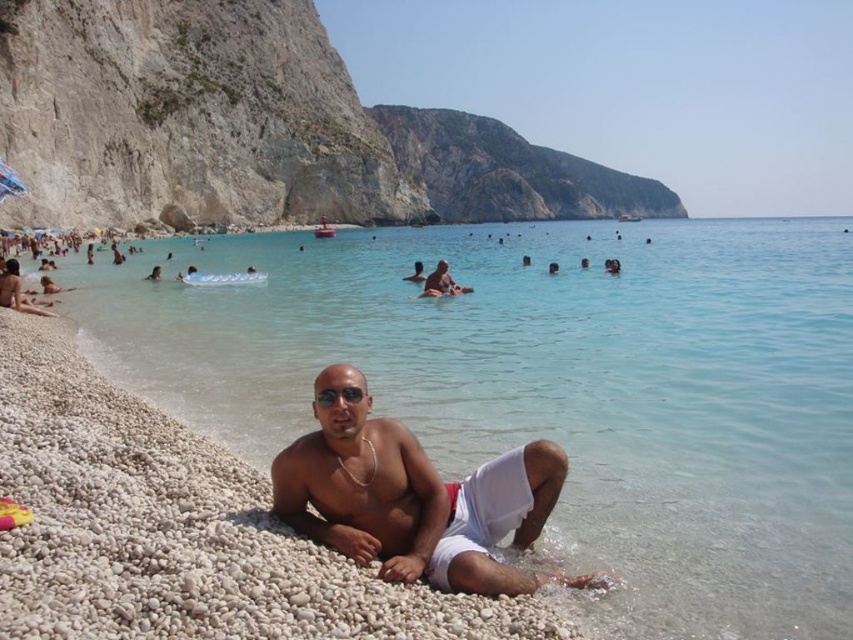
Which is more to the right, clear blue water at center or black reflective sunglasses at center?

clear blue water at center is more to the right.

Image resolution: width=853 pixels, height=640 pixels. Describe the element at coordinates (552, 387) in the screenshot. I see `clear blue water at center` at that location.

Which is behind, point (204, 403) or point (361, 392)?

Point (204, 403)

Where is `clear blue water at center`? clear blue water at center is located at coordinates 552,387.

Can you confirm if clear blue water at center is positioned to the right of white cotton shorts at lower center?

Indeed, clear blue water at center is positioned on the right side of white cotton shorts at lower center.

Does clear blue water at center appear under white cotton shorts at lower center?

Incorrect, clear blue water at center is not positioned below white cotton shorts at lower center.

Does point (708, 365) come closer to viewer compared to point (468, 573)?

No, it is behind (468, 573).

At what (x,y) coordinates should I click in order to perform the action: click on clear blue water at center. Please return your answer as a coordinate pair (x, y). Looking at the image, I should click on (552, 387).

Measure the distance between white cotton shorts at lower center and black reflective sunglasses at center.

white cotton shorts at lower center is 4.14 meters from black reflective sunglasses at center.

Who is more forward, [450,570] or [357,397]?

Positioned in front is point [450,570].

I want to click on white cotton shorts at lower center, so click(x=415, y=499).